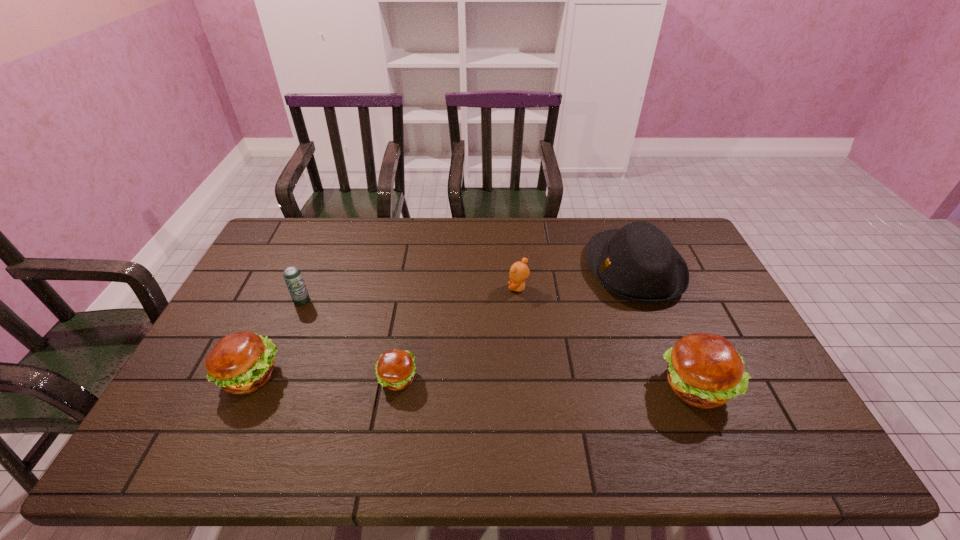
Identify which object is the second nearest to the teddy bear. Please provide its 2D coordinates. Your answer should be formatted as a tuple, i.e. [(x, y)], where the tuple contains the x and y coordinates of a point satisfying the conditions above.

[(395, 369)]

Locate an element on the screen. Image resolution: width=960 pixels, height=540 pixels. hamburger identified as the third closest to the beer can is located at coordinates (704, 370).

You are a GUI agent. You are given a task and a screenshot of the screen. Output one action in this format:
    pyautogui.click(x=<x>, y=<y>)
    Task: Click on the hamburger that is the second closest to the shortest object
    Image resolution: width=960 pixels, height=540 pixels.
    Given the screenshot: What is the action you would take?
    pyautogui.click(x=704, y=370)

Locate an element on the screen. This screenshot has height=540, width=960. vacant area that satisfies the following two spatial constraints: 1. on the face of the rightmost hamburger; 2. on the left side of the fourth object from left to right is located at coordinates (527, 386).

Image resolution: width=960 pixels, height=540 pixels. I want to click on vacant region that satisfies the following two spatial constraints: 1. on the front-facing side of the fedora; 2. on the left side of the rightmost hamburger, so click(681, 386).

At what (x,y) coordinates should I click in order to perform the action: click on vacant space that satisfies the following two spatial constraints: 1. on the front side of the shortest object; 2. on the left side of the beer can. Please return your answer as a coordinate pair (x, y). Looking at the image, I should click on pyautogui.click(x=269, y=379).